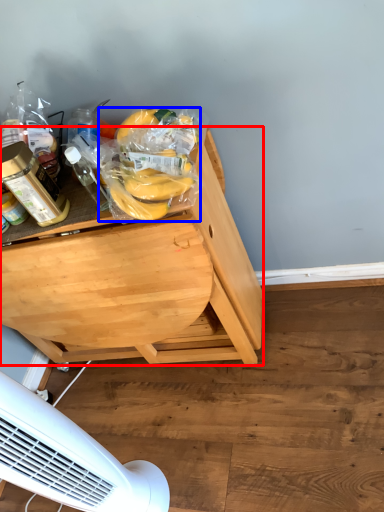
Question: Which object appears closest to the camera in this image, desk (highlighted by a red box) or food (highlighted by a blue box)?

Choices:
 (A) desk
 (B) food

Answer: (B)